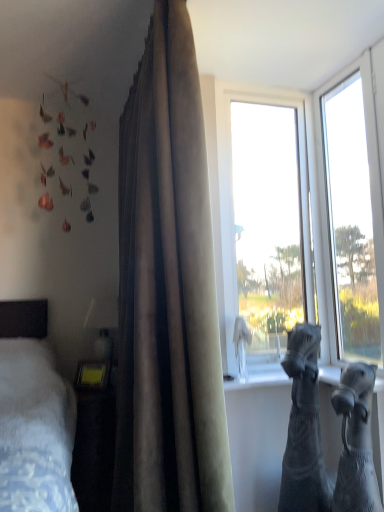
Question: Looking at the image, does satin-like beige curtain at center seem bigger or smaller compared to black denim jeans at lower right, the first animal positioned from the back?

Choices:
 (A) small
 (B) big

Answer: (B)

Question: Is satin-like beige curtain at center situated inside black denim jeans at lower right, the first animal positioned from the back, or outside?

Choices:
 (A) outside
 (B) inside

Answer: (A)

Question: Which is nearer to the black knitted socks at lower right, positioned as the 1th animal in front-to-back order?

Choices:
 (A) satin-like beige curtain at center
 (B) transparent glass window at upper right, which is the 2th window from left to right
 (C) black denim jeans at lower right, the first animal positioned from the back
 (D) transparent glass window at upper right, which is counted as the second window, starting from the right

Answer: (C)

Question: Which of these objects is positioned farthest from the transparent glass window at upper right, placed as the first window when sorted from right to left?

Choices:
 (A) black knitted socks at lower right, positioned as the 1th animal in front-to-back order
 (B) black denim jeans at lower right, the first animal positioned from the back
 (C) transparent glass window at upper right, which is counted as the second window, starting from the right
 (D) satin-like beige curtain at center

Answer: (D)